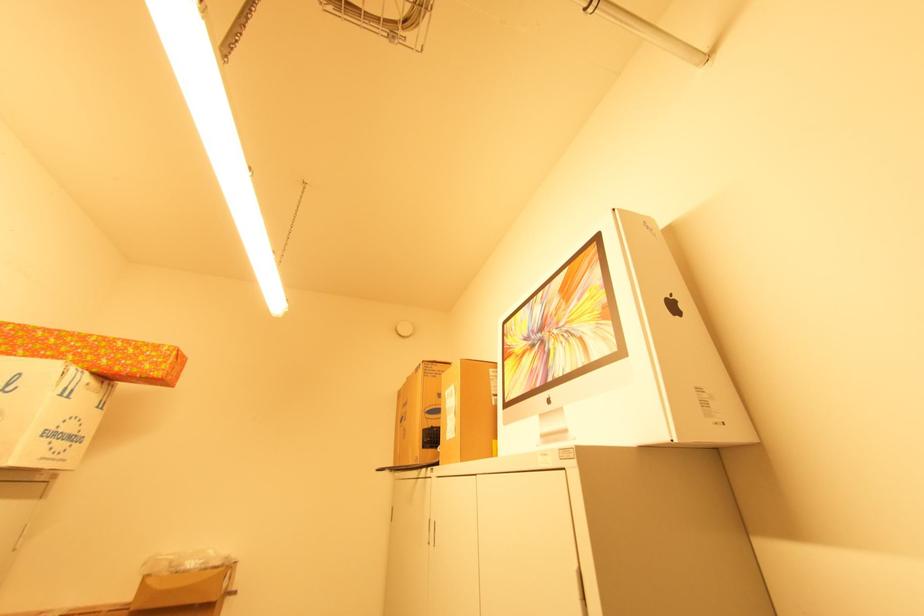
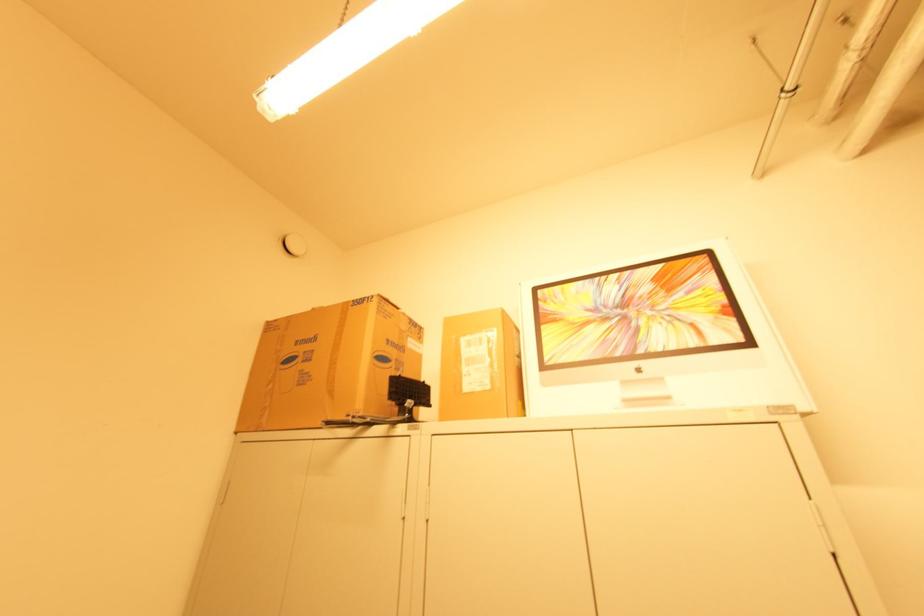
Find the pixel in the second image that matches (409,379) in the first image.

(315, 309)